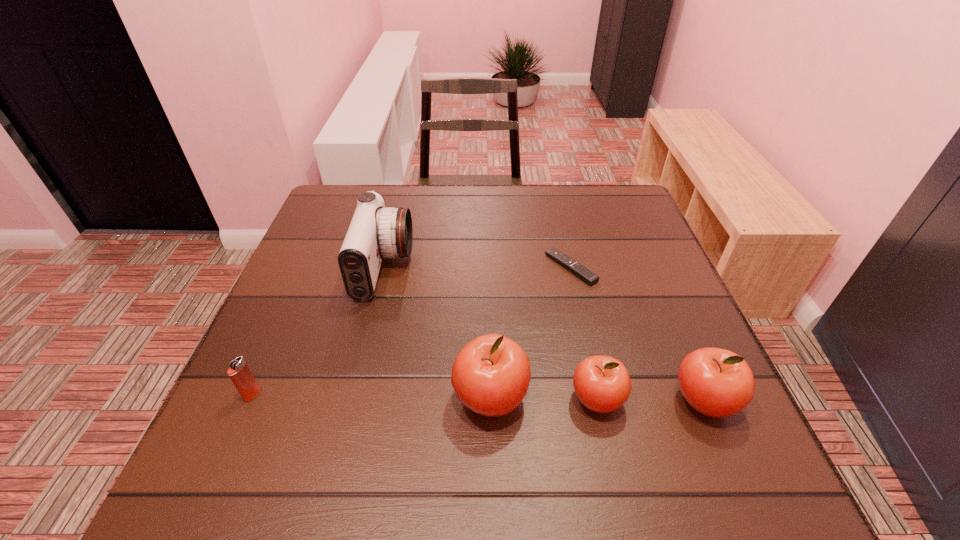
Observe the arrangement of all apples in the image. To keep them evenly spaced, where would you place another apple on the left? Please locate a free space. Please provide its 2D coordinates. Your answer should be formatted as a tuple, i.e. [(x, y)], where the tuple contains the x and y coordinates of a point satisfying the conditions above.

[(385, 396)]